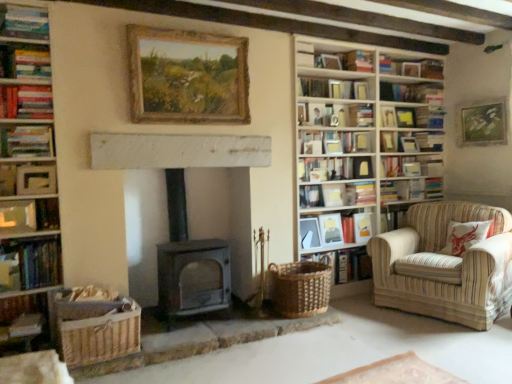
Question: Is matte white frame at upper left, the eighth book in the top-to-bottom sequence, inside hardcover books at left, which is counted as the eleventh book, starting from the bottom?

Choices:
 (A) yes
 (B) no

Answer: (B)

Question: Does hardcover books at left, which appears as the 3th book when viewed from the top, appear on the left side of matte white frame at upper left, which is counted as the 6th book, starting from the bottom?

Choices:
 (A) yes
 (B) no

Answer: (B)

Question: Is hardcover books at left, which appears as the 3th book when viewed from the top, turned away from matte white frame at upper left, the eighth book in the top-to-bottom sequence?

Choices:
 (A) yes
 (B) no

Answer: (B)

Question: Is hardcover books at left, which is counted as the eleventh book, starting from the bottom, far from matte white frame at upper left, which is counted as the 6th book, starting from the bottom?

Choices:
 (A) yes
 (B) no

Answer: (B)

Question: Does hardcover books at left, which is counted as the eleventh book, starting from the bottom, have a lesser height compared to matte white frame at upper left, which is counted as the 6th book, starting from the bottom?

Choices:
 (A) no
 (B) yes

Answer: (A)

Question: Relative to wooden bookshelf at right, is wooden woven basket at lower left, which is counted as the first basket, starting from the left, in front or behind?

Choices:
 (A) behind
 (B) front

Answer: (B)

Question: Does point (59, 321) appear closer or farther from the camera than point (422, 117)?

Choices:
 (A) closer
 (B) farther

Answer: (A)

Question: Looking at the image, does wooden woven basket at lower left, which is counted as the first basket, starting from the left, seem bigger or smaller compared to wooden bookshelf at right?

Choices:
 (A) small
 (B) big

Answer: (A)

Question: Is wooden woven basket at lower left, the 2th basket from the back, situated inside wooden bookshelf at right or outside?

Choices:
 (A) outside
 (B) inside

Answer: (A)

Question: Is wooden bookshelf at right in front of or behind matte silver picture frame at center, placed as the fourth picture frame when sorted from right to left, in the image?

Choices:
 (A) front
 (B) behind

Answer: (A)

Question: Considering the positions of wooden bookshelf at right and matte silver picture frame at center, the 2th picture frame from the left, in the image, is wooden bookshelf at right taller or shorter than matte silver picture frame at center, the 2th picture frame from the left,?

Choices:
 (A) tall
 (B) short

Answer: (A)

Question: From a real-world perspective, is wooden bookshelf at right positioned above or below matte silver picture frame at center, acting as the 4th picture frame starting from the back?

Choices:
 (A) above
 (B) below

Answer: (A)

Question: Is point (435, 79) closer or farther from the camera than point (312, 236)?

Choices:
 (A) farther
 (B) closer

Answer: (A)

Question: Does point (228, 119) appear closer or farther from the camera than point (330, 231)?

Choices:
 (A) closer
 (B) farther

Answer: (A)

Question: From a real-world perspective, is wooden-framed painting at upper center, positioned as the fifth picture frame in bottom-to-top order, positioned above or below matte white frame at upper right, acting as the 3th book starting from the bottom?

Choices:
 (A) above
 (B) below

Answer: (A)